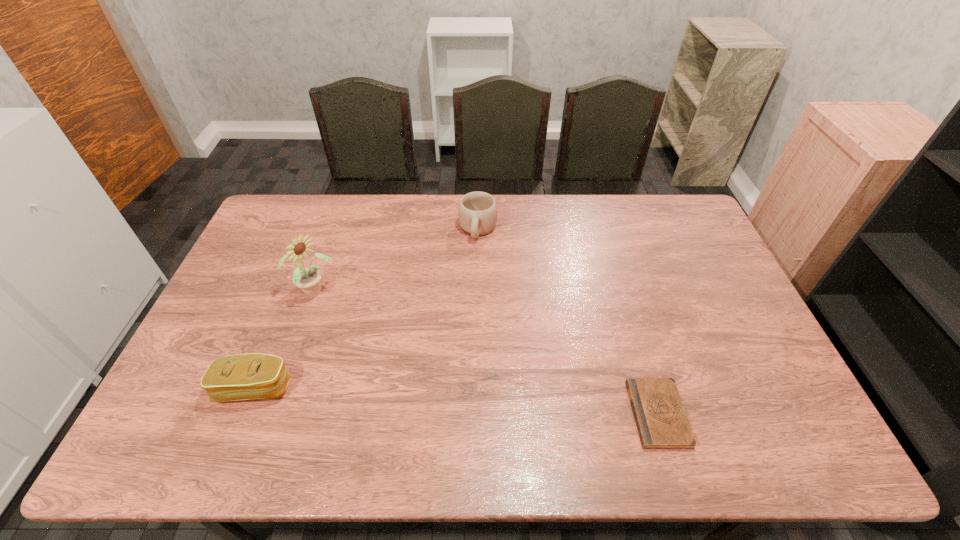
The height and width of the screenshot is (540, 960). Find the location of `clutch bag`. clutch bag is located at coordinates (249, 376).

The height and width of the screenshot is (540, 960). What are the coordinates of `the rightmost object` in the screenshot? It's located at (661, 420).

This screenshot has width=960, height=540. I want to click on diary, so click(x=661, y=420).

This screenshot has width=960, height=540. Find the location of `the second farthest object`. the second farthest object is located at coordinates (308, 279).

The height and width of the screenshot is (540, 960). In order to click on the tallest object in this screenshot , I will do `click(308, 279)`.

This screenshot has width=960, height=540. I want to click on mug, so click(x=477, y=212).

This screenshot has width=960, height=540. In order to click on the farthest object in this screenshot , I will do tap(477, 212).

The width and height of the screenshot is (960, 540). I want to click on vacant space located on the spine side of the rightmost object, so click(544, 414).

At what (x,y) coordinates should I click in order to perform the action: click on free space located 0.320m on the spine side of the rightmost object. Please return your answer as a coordinate pair (x, y). The image size is (960, 540). Looking at the image, I should click on (504, 414).

At what (x,y) coordinates should I click in order to perform the action: click on free space located on the spine side of the rightmost object. Please return your answer as a coordinate pair (x, y). Image resolution: width=960 pixels, height=540 pixels. Looking at the image, I should click on (609, 414).